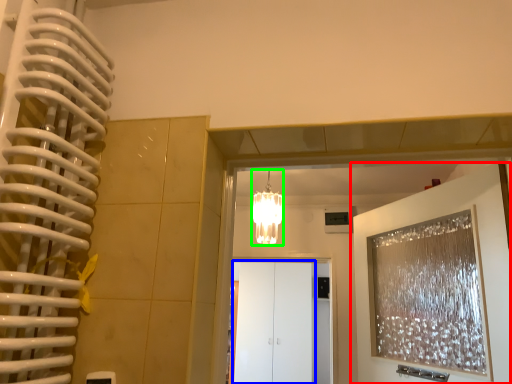
Question: Which object is positioned closest to door (highlighted by a red box)? Select from glass door (highlighted by a blue box) and lamp (highlighted by a green box).

Choices:
 (A) glass door
 (B) lamp

Answer: (B)